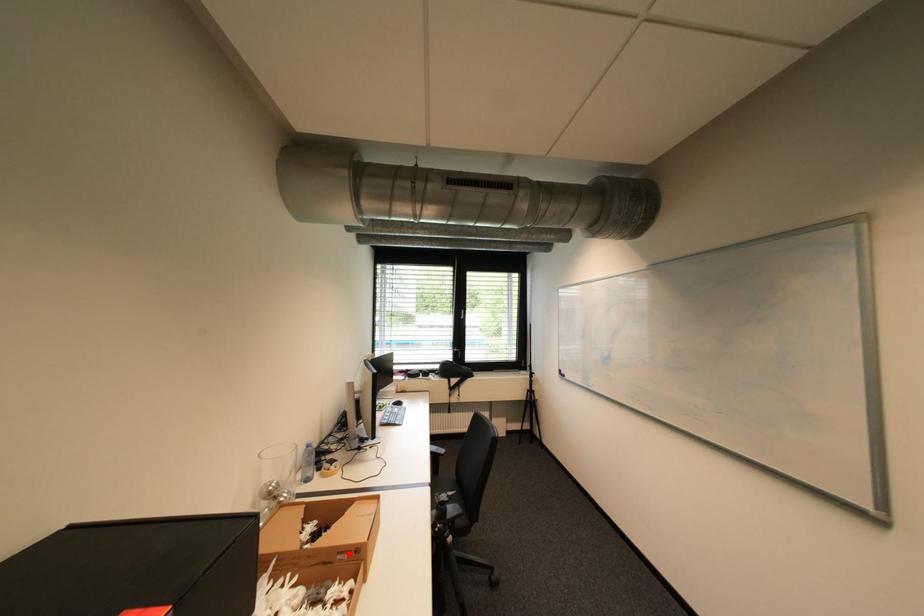
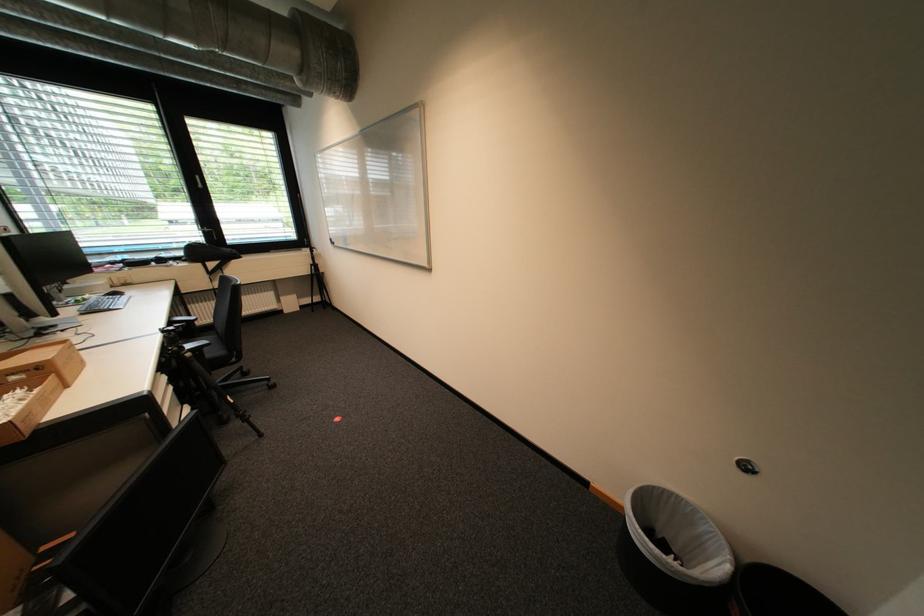
Question: I am providing you with two images of the same scene from different viewpoints. A red point is marked on the first image. At the location where the point appears in image 1, is it still visible in image 2?

Choices:
 (A) Yes
 (B) No

Answer: (A)